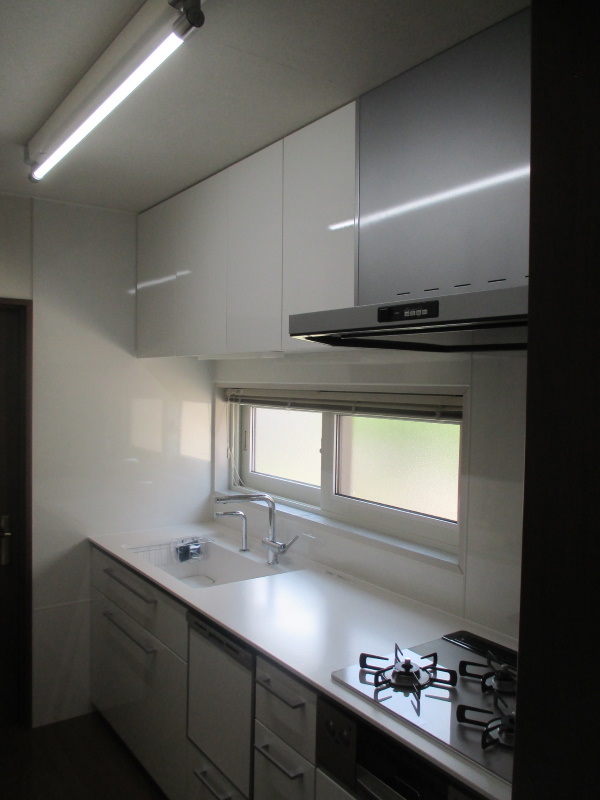
Identify the location of kitchen sink. This screenshot has height=800, width=600. (210, 574).